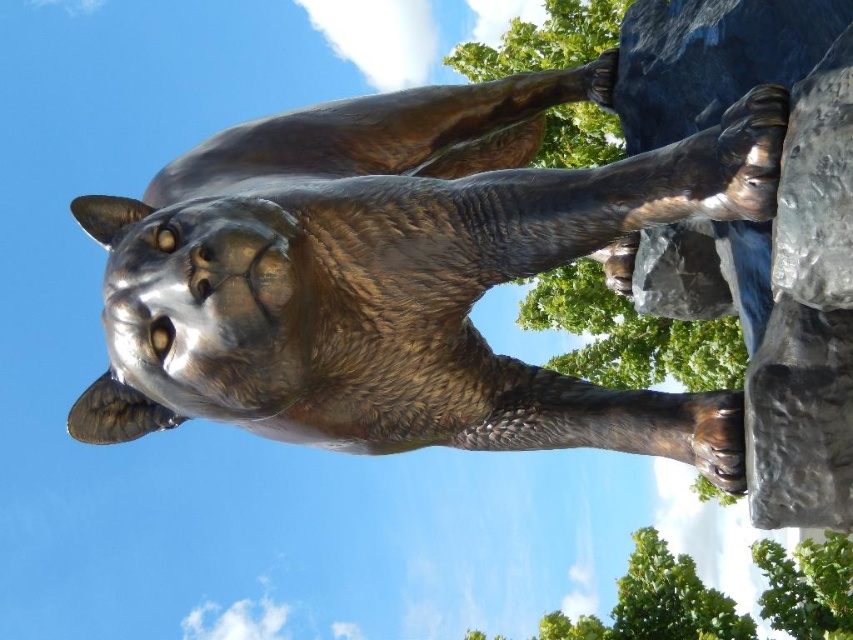
You are a maintenance worker who needs to clean the bronze statue at center and the dark gray rough stone at upper right. You have a 20 cm long cleaning rod. Can you reach both objects without moving your position?

The bronze statue at center and dark gray rough stone at upper right are 17.98 centimeters apart from each other. Since the cleaning rod is 20 cm long, which is longer than the distance between them, you can reach both objects without moving your position.

Based on the photo, you are an art conservator assessing the spacing between the bronze statue at center and the dark gray rough stone at upper right. Which object is wider?

The bronze statue at center is wider than the dark gray rough stone at upper right.